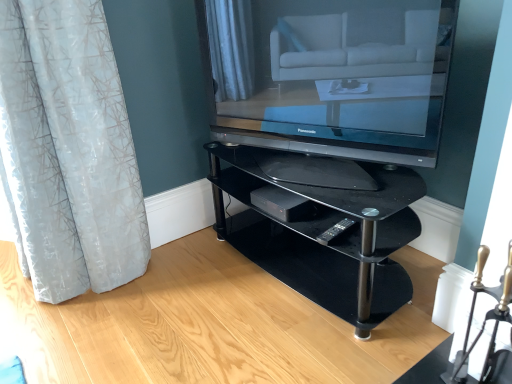
Measure the distance between black plastic remote at lower center and camera.

black plastic remote at lower center and camera are 5.01 feet apart from each other.

In order to face translucent white curtain at left, should I rotate leftwards or rightwards?

To face it directly, rotate left by 27.793 degrees.

Describe the element at coordinates (68, 150) in the screenshot. This screenshot has width=512, height=384. I see `translucent white curtain at left` at that location.

Find the location of a particular element. Image resolution: width=512 pixels, height=384 pixels. matte black television at center is located at coordinates (330, 75).

Find the location of a particular element. The height and width of the screenshot is (384, 512). black glass shelf at center is located at coordinates (323, 231).

In order to click on shelf behind the matte black television at center in this screenshot , I will do `click(323, 231)`.

In terms of height, does black glass shelf at center look taller or shorter compared to matte black television at center?

black glass shelf at center is shorter than matte black television at center.

Who is smaller, black glass shelf at center or matte black television at center?

matte black television at center is smaller.

Is black glass shelf at center in front of or behind matte black television at center in the image?

Visually, black glass shelf at center is located behind matte black television at center.

Based on the photo, which is more to the right, matte black television at center or black plastic remote at lower center?

black plastic remote at lower center is more to the right.

From a real-world perspective, is matte black television at center located beneath black plastic remote at lower center?

No, from a real-world perspective, matte black television at center is not under black plastic remote at lower center.

Is matte black television at center bigger than black plastic remote at lower center?

Yes.

From the picture: Is black glass shelf at center at the right side of black plastic remote at lower center?

→ No, black glass shelf at center is not to the right of black plastic remote at lower center.

Identify the location of remote below the black glass shelf at center (from the image's perspective). (335, 231).

Is black glass shelf at center turned away from black plastic remote at lower center?

No.

There is a black glass shelf at center. Where is `curtain above it (from a real-world perspective)`? The width and height of the screenshot is (512, 384). curtain above it (from a real-world perspective) is located at coordinates (68, 150).

Does translucent white curtain at left appear on the left side of black glass shelf at center?

Indeed, translucent white curtain at left is positioned on the left side of black glass shelf at center.

Is translucent white curtain at left oriented away from black glass shelf at center?

translucent white curtain at left does not have its back to black glass shelf at center.

Can you confirm if translucent white curtain at left is smaller than black glass shelf at center?

No.

From a real-world perspective, between black plastic remote at lower center and translucent white curtain at left, who is vertically higher?

From a 3D spatial view, translucent white curtain at left is above.

Is point (324, 238) less distant than point (65, 272)?

That is True.

Which is more to the left, black plastic remote at lower center or translucent white curtain at left?

translucent white curtain at left is more to the left.

Can you confirm if black plastic remote at lower center is wider than matte black television at center?

No, black plastic remote at lower center is not wider than matte black television at center.

Considering the sizes of black plastic remote at lower center and matte black television at center in the image, is black plastic remote at lower center bigger or smaller than matte black television at center?

black plastic remote at lower center is smaller than matte black television at center.

Between black plastic remote at lower center and matte black television at center, which one appears on the right side from the viewer's perspective?

Positioned to the right is black plastic remote at lower center.

The height and width of the screenshot is (384, 512). Find the location of `television located in front of the black plastic remote at lower center`. television located in front of the black plastic remote at lower center is located at coordinates (330, 75).

Identify the location of television lying in front of the translucent white curtain at left. (330, 75).

In the scene shown: Does translucent white curtain at left turn towards matte black television at center?

No, translucent white curtain at left is not oriented towards matte black television at center.

Do you think translucent white curtain at left is within matte black television at center, or outside of it?

translucent white curtain at left is not enclosed by matte black television at center.

In the image, there is a matte black television at center. What are the coordinates of `shelf below it (from a real-world perspective)` in the screenshot? It's located at (323, 231).

You are a GUI agent. You are given a task and a screenshot of the screen. Output one action in this format:
    pyautogui.click(x=<x>, y=<y>)
    Task: Click on the television above the black plastic remote at lower center (from the image's perspective)
    The image size is (512, 384).
    Given the screenshot: What is the action you would take?
    pyautogui.click(x=330, y=75)

Which object lies further to the anchor point black plastic remote at lower center, black glass shelf at center or translucent white curtain at left?

translucent white curtain at left.

When comparing their distances from black glass shelf at center, does black plastic remote at lower center or matte black television at center seem further?

matte black television at center is further to black glass shelf at center.

Which object lies further to the anchor point translucent white curtain at left, black plastic remote at lower center or matte black television at center?

black plastic remote at lower center.

Based on their spatial positions, is black glass shelf at center or matte black television at center further from black plastic remote at lower center?

matte black television at center.

Considering their positions, is translucent white curtain at left positioned further to black glass shelf at center than black plastic remote at lower center?

translucent white curtain at left is further to black glass shelf at center.

From the image, which object appears to be farther from matte black television at center, black plastic remote at lower center or translucent white curtain at left?

translucent white curtain at left is further to matte black television at center.

Looking at the image, which one is located closer to matte black television at center, black glass shelf at center or black plastic remote at lower center?

Among the two, black glass shelf at center is located nearer to matte black television at center.

Based on their spatial positions, is matte black television at center or translucent white curtain at left closer to black glass shelf at center?

matte black television at center.

Where is `shelf between matte black television at center and black plastic remote at lower center vertically`? The width and height of the screenshot is (512, 384). shelf between matte black television at center and black plastic remote at lower center vertically is located at coordinates (323, 231).

The width and height of the screenshot is (512, 384). What are the coordinates of `television between translucent white curtain at left and black plastic remote at lower center in the horizontal direction` in the screenshot? It's located at (330, 75).

What are the coordinates of `television between translucent white curtain at left and black glass shelf at center from left to right` in the screenshot? It's located at (330, 75).

This screenshot has width=512, height=384. I want to click on shelf situated between translucent white curtain at left and black plastic remote at lower center from left to right, so click(323, 231).